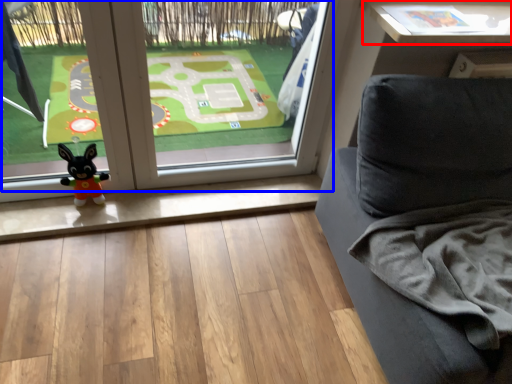
Question: Which point is closer to the camera, table (highlighted by a red box) or window (highlighted by a blue box)?

Choices:
 (A) table
 (B) window

Answer: (B)